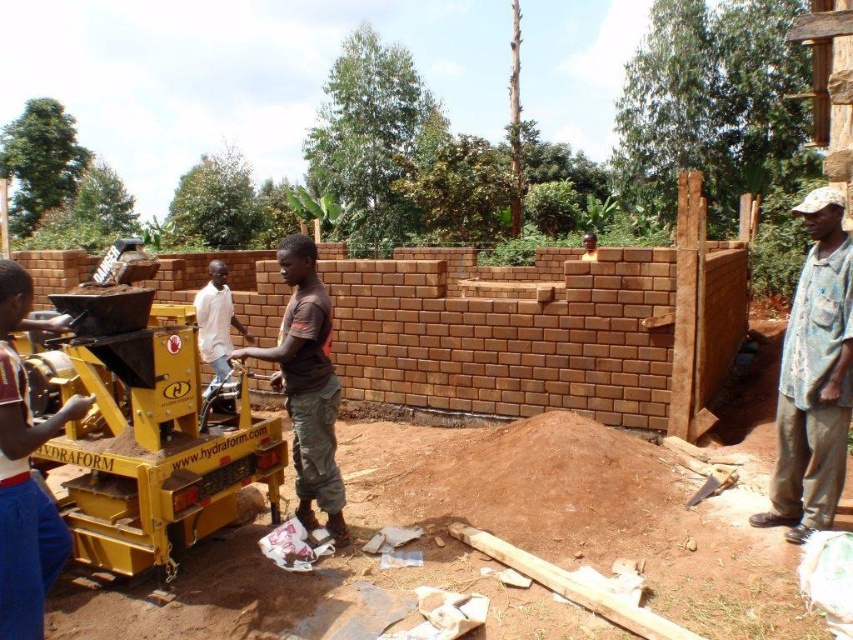
Question: Estimate the real-world distances between objects in this image. Which object is closer to the matte yellow machine at center?

Choices:
 (A) denim shirt at right
 (B) white matte shirt at center

Answer: (B)

Question: Can you confirm if denim shirt at right is thinner than white matte shirt at center?

Choices:
 (A) no
 (B) yes

Answer: (B)

Question: Is matte yellow machine at center further to the viewer compared to white matte shirt at center?

Choices:
 (A) yes
 (B) no

Answer: (B)

Question: Which point is closer to the camera?

Choices:
 (A) (223, 404)
 (B) (3, 561)
 (C) (819, 252)

Answer: (B)

Question: Which object is the farthest from the matte yellow machine at center?

Choices:
 (A) denim shirt at right
 (B) white matte shirt at center

Answer: (A)

Question: Does denim shirt at right appear on the left side of brown matte shirt at center?

Choices:
 (A) no
 (B) yes

Answer: (A)